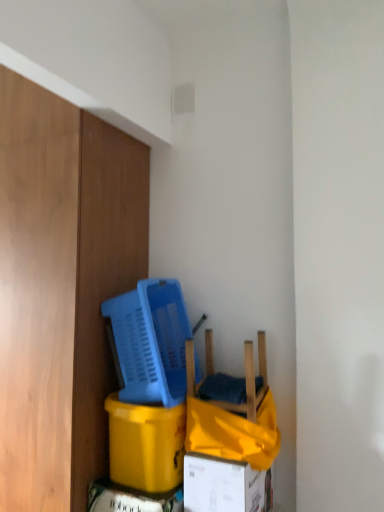
In order to face blue plastic basket at center, should I rotate leftwards or rightwards?

You should rotate left by 4.732 degrees.

What do you see at coordinates (230, 379) in the screenshot? I see `wooden chair at lower center` at bounding box center [230, 379].

The width and height of the screenshot is (384, 512). I want to click on wooden chair at lower center, so click(230, 379).

You are a GUI agent. You are given a task and a screenshot of the screen. Output one action in this format:
    pyautogui.click(x=<x>, y=<y>)
    Task: Click on the yellow cardboard box at lower left
    This screenshot has height=512, width=384.
    Given the screenshot: What is the action you would take?
    pyautogui.click(x=146, y=445)

Can you confirm if white cardboard box at lower center is thinner than wooden chair at lower center?

Yes.

From the image's perspective, between white cardboard box at lower center and wooden chair at lower center, which one is located above?

From the image's view, wooden chair at lower center is above.

Considering the relative sizes of white cardboard box at lower center and wooden chair at lower center in the image provided, is white cardboard box at lower center smaller than wooden chair at lower center?

Yes.

Consider the image. Are blue plastic basket at center and wooden chair at lower center beside each other?

No, blue plastic basket at center is not with wooden chair at lower center.

Visually, is blue plastic basket at center positioned to the left or to the right of wooden chair at lower center?

From the image, it's evident that blue plastic basket at center is to the left of wooden chair at lower center.

What's the angular difference between blue plastic basket at center and wooden chair at lower center's facing directions?

0.438 degrees separate the facing orientations of blue plastic basket at center and wooden chair at lower center.

In terms of width, does blue plastic basket at center look wider or thinner when compared to yellow cardboard box at lower left?

blue plastic basket at center is wider than yellow cardboard box at lower left.

Can you tell me how much blue plastic basket at center and yellow cardboard box at lower left differ in facing direction?

They differ by 0.279 degrees in their facing directions.

Would you say blue plastic basket at center is a long distance from yellow cardboard box at lower left?

blue plastic basket at center is actually quite close to yellow cardboard box at lower left.

In terms of height, does blue plastic basket at center look taller or shorter compared to yellow cardboard box at lower left?

blue plastic basket at center is taller than yellow cardboard box at lower left.

Is yellow cardboard box at lower left bigger than white cardboard box at lower center?

Indeed, yellow cardboard box at lower left has a larger size compared to white cardboard box at lower center.

Considering the positions of points (176, 485) and (189, 478), is point (176, 485) closer to camera compared to point (189, 478)?

No, it is behind (189, 478).

Is yellow cardboard box at lower left inside or outside of white cardboard box at lower center?

The correct answer is: outside.

From the image's perspective, relative to white cardboard box at lower center, is yellow cardboard box at lower left above or below?

yellow cardboard box at lower left is situated higher than white cardboard box at lower center in the image.

Is blue plastic basket at center facing towards white cardboard box at lower center?

No, blue plastic basket at center is not oriented towards white cardboard box at lower center.

Find the location of a particular element. box lying in front of the blue plastic basket at center is located at coordinates (225, 486).

From a real-world perspective, is blue plastic basket at center over white cardboard box at lower center?

Indeed, from a real-world perspective, blue plastic basket at center stands above white cardboard box at lower center.

Is point (262, 332) farther from camera compared to point (146, 304)?

Yes, it is behind point (146, 304).

Is wooden chair at lower center behind blue plastic basket at center?

No, wooden chair at lower center is in front of blue plastic basket at center.

How different are the orientations of wooden chair at lower center and blue plastic basket at center in degrees?

The angle between the facing direction of wooden chair at lower center and the facing direction of blue plastic basket at center is 0.438 degrees.

From the image's perspective, is wooden chair at lower center below blue plastic basket at center?

Yes, from the image's perspective, wooden chair at lower center is below blue plastic basket at center.

Does white cardboard box at lower center have a lesser height compared to yellow cardboard box at lower left?

Yes.

Is white cardboard box at lower center positioned beyond the bounds of yellow cardboard box at lower left?

white cardboard box at lower center lies outside yellow cardboard box at lower left's area.

Between white cardboard box at lower center and yellow cardboard box at lower left, which one has smaller size?

Smaller between the two is white cardboard box at lower center.

Is white cardboard box at lower center oriented towards yellow cardboard box at lower left?

No, white cardboard box at lower center is not oriented towards yellow cardboard box at lower left.

Where is `chair located above the white cardboard box at lower center (from the image's perspective)`? The image size is (384, 512). chair located above the white cardboard box at lower center (from the image's perspective) is located at coordinates pyautogui.click(x=230, y=379).

What are the coordinates of `chair on the right of the blue plastic basket at center` in the screenshot? It's located at (230, 379).

Estimate the real-world distances between objects in this image. Which object is closer to wooden chair at lower center, blue plastic basket at center or white cardboard box at lower center?

blue plastic basket at center.

Looking at the image, which one is located closer to blue plastic basket at center, yellow cardboard box at lower left or white cardboard box at lower center?

Based on the image, yellow cardboard box at lower left appears to be nearer to blue plastic basket at center.

Looking at the image, which one is located further to white cardboard box at lower center, yellow cardboard box at lower left or blue plastic basket at center?

The object further to white cardboard box at lower center is blue plastic basket at center.

Considering their positions, is white cardboard box at lower center positioned closer to wooden chair at lower center than yellow cardboard box at lower left?

Based on the image, yellow cardboard box at lower left appears to be nearer to wooden chair at lower center.

Estimate the real-world distances between objects in this image. Which object is further from yellow cardboard box at lower left, white cardboard box at lower center or blue plastic basket at center?

blue plastic basket at center.

Which object lies further to the anchor point blue plastic basket at center, wooden chair at lower center or white cardboard box at lower center?

Among the two, white cardboard box at lower center is located further to blue plastic basket at center.

From the image, which object appears to be farther from blue plastic basket at center, yellow cardboard box at lower left or wooden chair at lower center?

yellow cardboard box at lower left is positioned further to the anchor blue plastic basket at center.

Considering their positions, is wooden chair at lower center positioned further to yellow cardboard box at lower left than blue plastic basket at center?

wooden chair at lower center.

You are a GUI agent. You are given a task and a screenshot of the screen. Output one action in this format:
    pyautogui.click(x=<x>, y=<y>)
    Task: Click on the chair between blue plastic basket at center and yellow cardboard box at lower left vertically
    
    Given the screenshot: What is the action you would take?
    pyautogui.click(x=230, y=379)

The width and height of the screenshot is (384, 512). Identify the location of chair between blue plastic basket at center and white cardboard box at lower center from top to bottom. (230, 379).

Where is `cardboard box that lies between wooden chair at lower center and white cardboard box at lower center from top to bottom`? cardboard box that lies between wooden chair at lower center and white cardboard box at lower center from top to bottom is located at coordinates (146, 445).

You are a GUI agent. You are given a task and a screenshot of the screen. Output one action in this format:
    pyautogui.click(x=<x>, y=<y>)
    Task: Click on the cardboard box between blue plastic basket at center and white cardboard box at lower center from top to bottom
    The width and height of the screenshot is (384, 512).
    Given the screenshot: What is the action you would take?
    pyautogui.click(x=146, y=445)